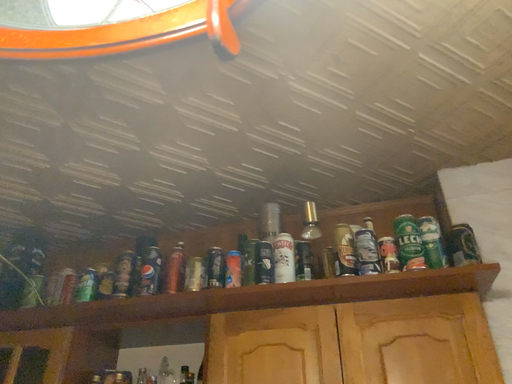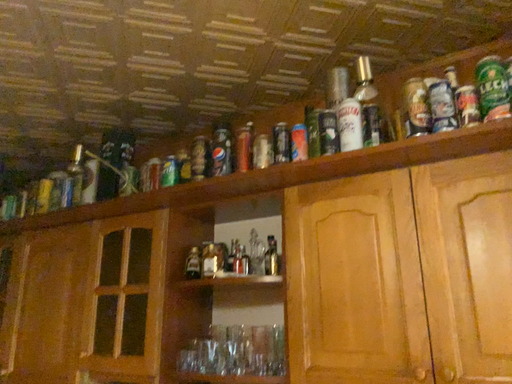
Question: How did the camera likely rotate when shooting the video?

Choices:
 (A) rotated downward
 (B) rotated upward

Answer: (A)